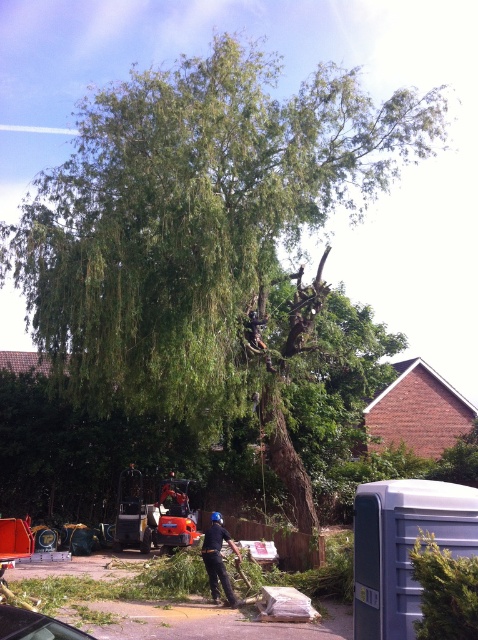
Is metallic gray car at lower left wider than black fabric person at center?

Yes.

Is metallic gray car at lower left above black fabric person at center?

Yes, metallic gray car at lower left is above black fabric person at center.

Find the location of `metallic gray car at lower left`. metallic gray car at lower left is located at coordinates (34, 625).